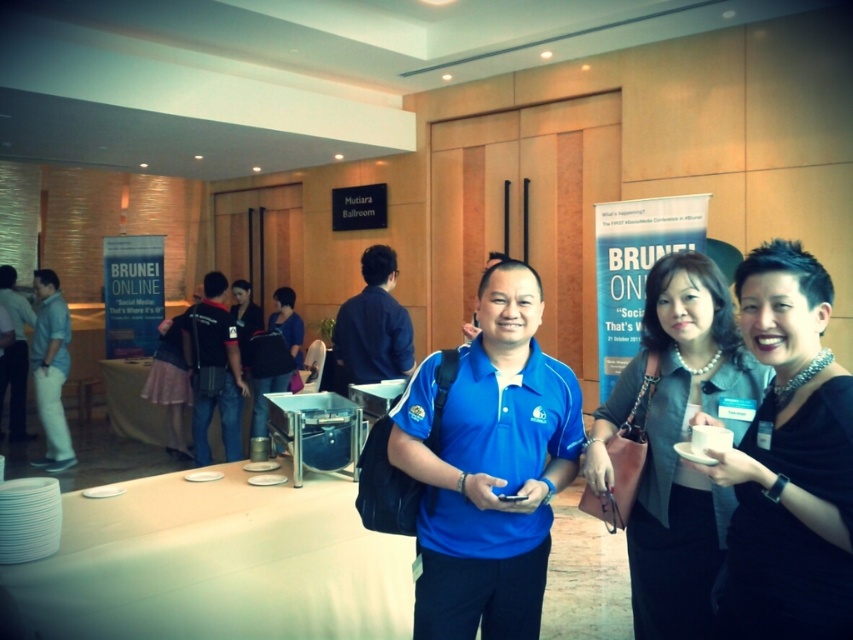
Does pearl necklace at upper center appear over matte white pants at left?

Correct, pearl necklace at upper center is located above matte white pants at left.

Measure the distance between pearl necklace at upper center and camera.

pearl necklace at upper center and camera are 5.68 feet apart from each other.

What are the coordinates of `pearl necklace at upper center` in the screenshot? It's located at (677, 440).

Is blue matte shirt at center smaller than blue fabric shirt at center?

Yes.

Does blue matte shirt at center lie behind blue fabric shirt at center?

→ No, blue matte shirt at center is in front of blue fabric shirt at center.

Is point (440, 422) positioned behind point (260, 385)?

No, it is not.

Locate an element on the screen. blue matte shirt at center is located at coordinates (489, 467).

Does pearl necklace at upper center have a greater width compared to blue fabric shirt at center?

Correct, the width of pearl necklace at upper center exceeds that of blue fabric shirt at center.

Who is more distant from viewer, (646,426) or (300,360)?

Point (300,360)

What do you see at coordinates (677, 440) in the screenshot?
I see `pearl necklace at upper center` at bounding box center [677, 440].

The height and width of the screenshot is (640, 853). Find the location of `pearl necklace at upper center`. pearl necklace at upper center is located at coordinates (677, 440).